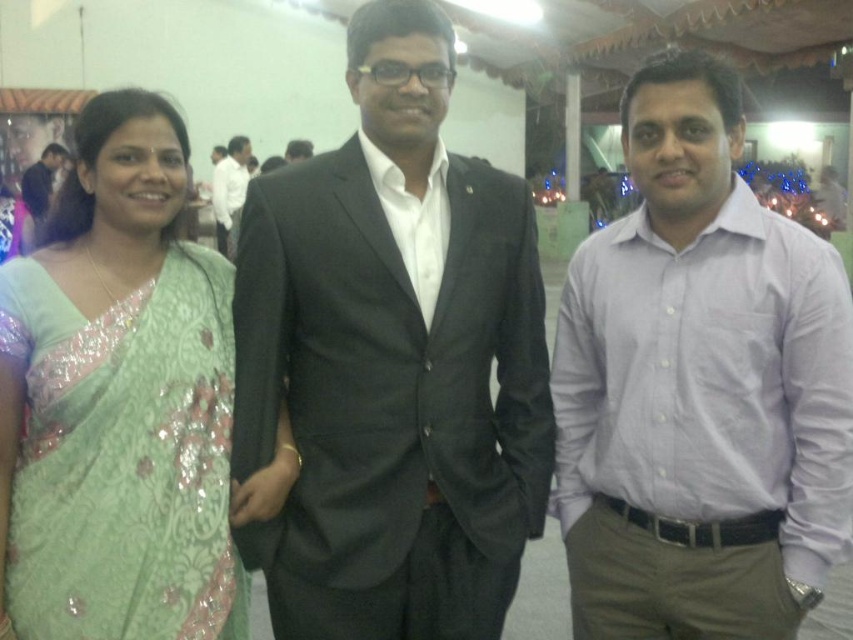
Question: Estimate the real-world distances between objects in this image. Which object is farther from the dark gray suit at center?

Choices:
 (A) black matte suit at center
 (B) matte black suit at center
 (C) light purple shirt at center
 (D) green sequined saree at left

Answer: (C)

Question: Is green sequined saree at left thinner than matte black suit at center?

Choices:
 (A) yes
 (B) no

Answer: (B)

Question: Is black matte suit at center to the left of light purple shirt at center from the viewer's perspective?

Choices:
 (A) no
 (B) yes

Answer: (B)

Question: Which point is closer to the camera?

Choices:
 (A) green sequined saree at left
 (B) matte black suit at center
 (C) light purple shirt at center

Answer: (C)

Question: Which point is closer to the camera?

Choices:
 (A) (236, 157)
 (B) (329, 376)
 (C) (660, 317)

Answer: (B)

Question: Can you confirm if light purple shirt at center is wider than green sequined saree at left?

Choices:
 (A) yes
 (B) no

Answer: (A)